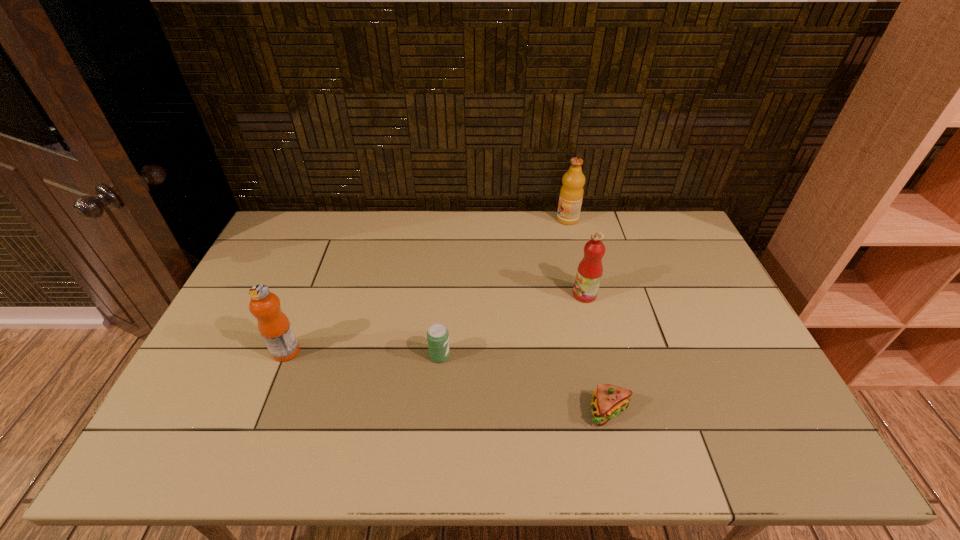
Find the location of `free space at the far left corner of the desktop`. free space at the far left corner of the desktop is located at coordinates click(271, 244).

At what (x,y) coordinates should I click in order to perform the action: click on vacant region between the soda and the farthest fruit juice. Please return your answer as a coordinate pair (x, y). Looking at the image, I should click on (504, 288).

Find the location of a particular element. vacant point located between the second nearest fruit juice and the soda is located at coordinates (513, 325).

You are a GUI agent. You are given a task and a screenshot of the screen. Output one action in this format:
    pyautogui.click(x=<x>, y=<y>)
    Task: Click on the free area in between the fourth nearest object and the farthest fruit juice
    Image resolution: width=960 pixels, height=540 pixels.
    Given the screenshot: What is the action you would take?
    pyautogui.click(x=576, y=257)

This screenshot has height=540, width=960. In order to click on vacant space that is in between the leftmost fruit juice and the nearest object in this screenshot , I will do `click(447, 381)`.

Locate an element on the screen. This screenshot has height=540, width=960. vacant area that lies between the farthest fruit juice and the second farthest object is located at coordinates (576, 257).

Identify the location of free point between the fourth object from right to left and the leftmost fruit juice. Image resolution: width=960 pixels, height=540 pixels. (363, 354).

This screenshot has width=960, height=540. I want to click on free spot between the nearest fruit juice and the farthest fruit juice, so click(427, 285).

Image resolution: width=960 pixels, height=540 pixels. What are the coordinates of `free area in between the second object from left to right and the sandwich` in the screenshot? It's located at (524, 383).

The height and width of the screenshot is (540, 960). Find the location of `blank region between the second farthest fruit juice and the soda`. blank region between the second farthest fruit juice and the soda is located at coordinates (513, 325).